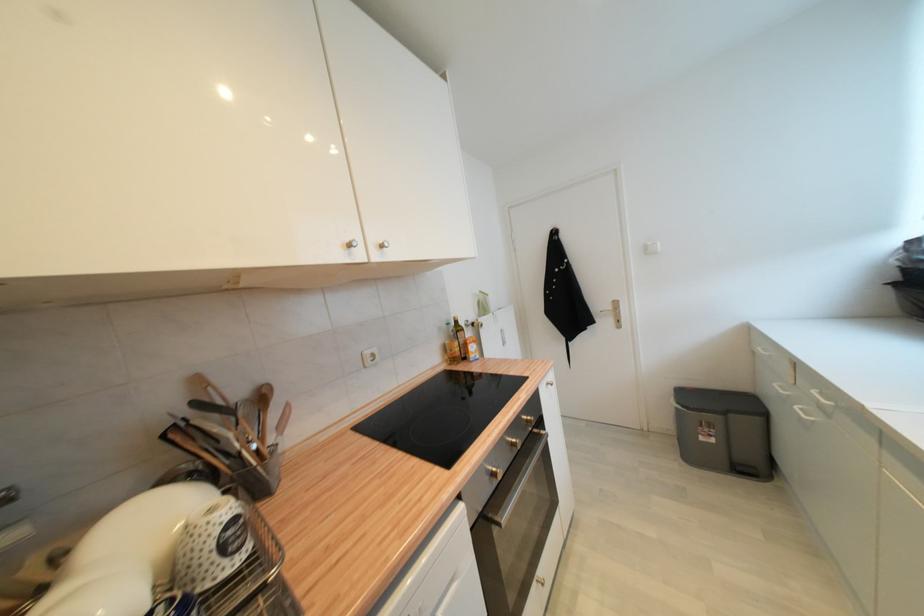
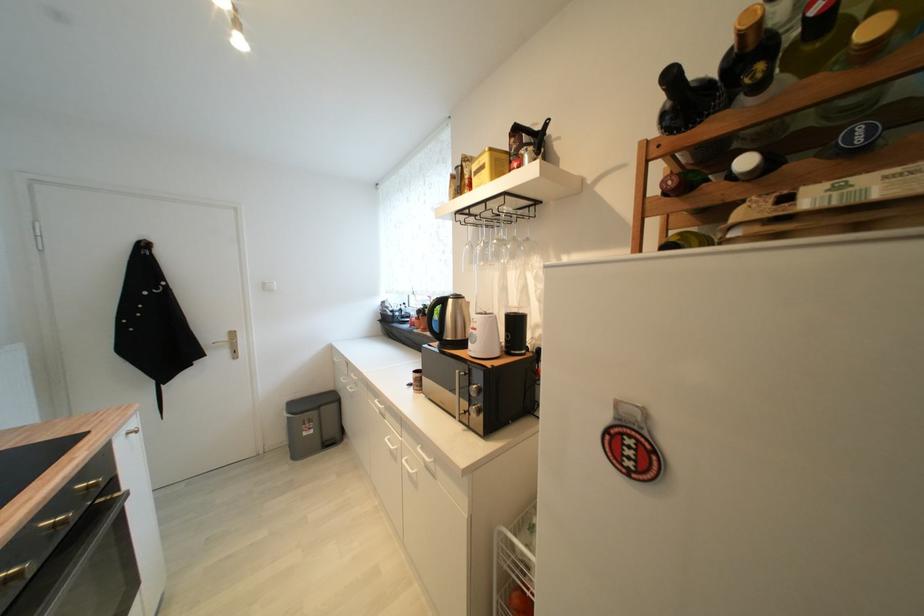
The point at (541,432) is marked in the first image. Where is the corresponding point in the second image?

(107, 503)